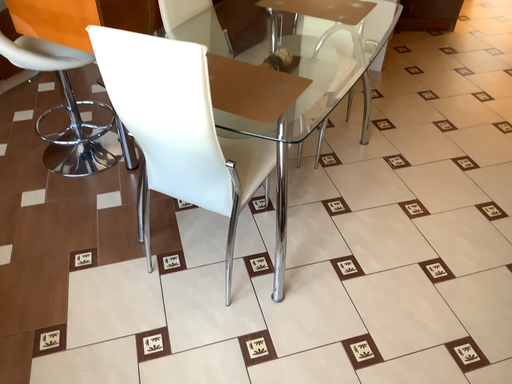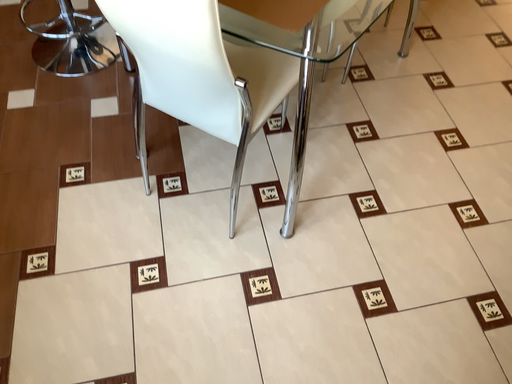
Question: How did the camera likely rotate when shooting the video?

Choices:
 (A) rotated upward
 (B) rotated downward

Answer: (B)